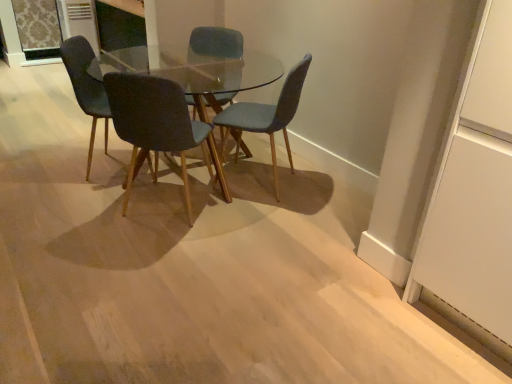
Find the location of a particular element. blank space to the left of transparent glass table at center is located at coordinates (57, 173).